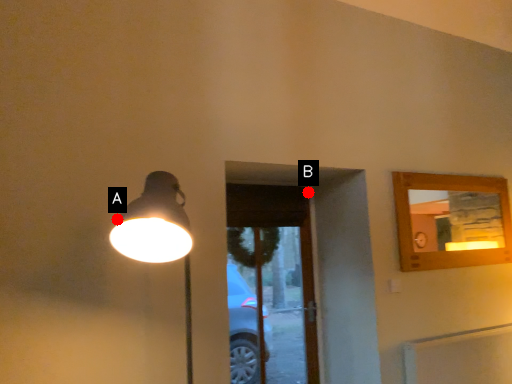
Question: Two points are circled on the image, labeled by A and B beside each circle. Which point is closer to the camera?

Choices:
 (A) A is closer
 (B) B is closer

Answer: (A)